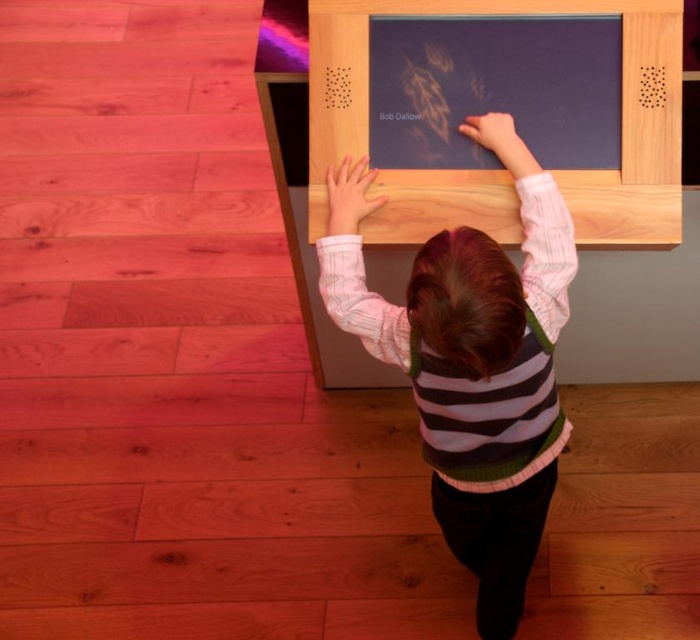
From the picture: Is matte wooden board at upper center taller than black glossy text at upper center?

Correct, matte wooden board at upper center is much taller as black glossy text at upper center.

From the picture: Who is lower down, matte wooden board at upper center or black glossy text at upper center?

matte wooden board at upper center is below.

Where is `matte wooden board at upper center`? The width and height of the screenshot is (700, 640). matte wooden board at upper center is located at coordinates [553, 170].

Image resolution: width=700 pixels, height=640 pixels. In order to click on matte wooden board at upper center in this screenshot , I will do (x=553, y=170).

Which is behind, point (550, 221) or point (382, 112)?

The point (382, 112) is behind.

Is striped sweater at center below black glossy text at upper center?

Correct, striped sweater at center is located below black glossy text at upper center.

Who is more forward, (449, 344) or (414, 112)?

Positioned in front is point (449, 344).

Find the location of a particular element. The image size is (700, 640). striped sweater at center is located at coordinates tap(472, 362).

Who is lower down, striped sweater at center or matte wooden board at upper center?

striped sweater at center is below.

Can you confirm if striped sweater at center is wider than matte wooden board at upper center?

No, striped sweater at center is not wider than matte wooden board at upper center.

Find the location of a particular element. striped sweater at center is located at coordinates (472, 362).

At what (x,y) coordinates should I click in order to perform the action: click on striped sweater at center. Please return your answer as a coordinate pair (x, y). The width and height of the screenshot is (700, 640). Looking at the image, I should click on (472, 362).